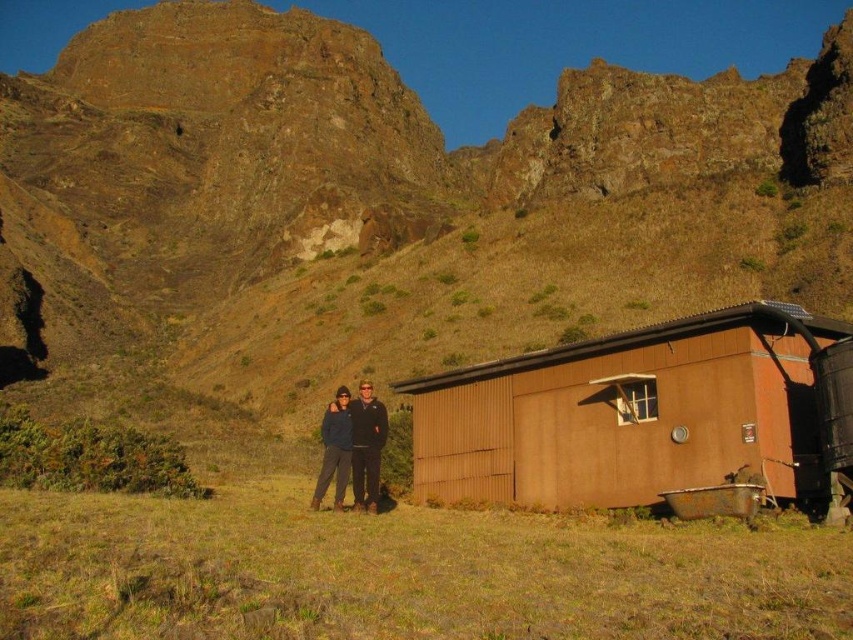
Does brown corrugated metal cabin at right have a greater height compared to dark blue jacket at center?

Yes, brown corrugated metal cabin at right is taller than dark blue jacket at center.

Is brown corrugated metal cabin at right positioned before dark blue jacket at center?

Yes, brown corrugated metal cabin at right is closer to the viewer.

This screenshot has width=853, height=640. What are the coordinates of `brown corrugated metal cabin at right` in the screenshot? It's located at (628, 413).